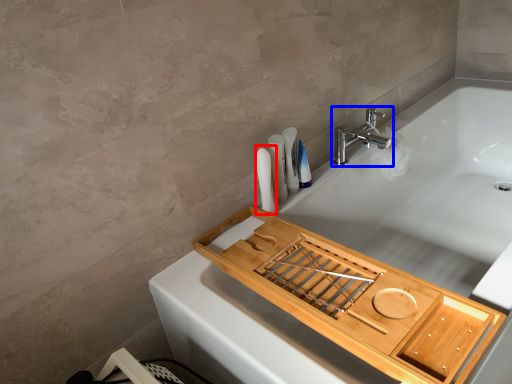
Question: Which of the following is the closest to the observer, toiletry (highlighted by a red box) or tap (highlighted by a blue box)?

Choices:
 (A) toiletry
 (B) tap

Answer: (A)